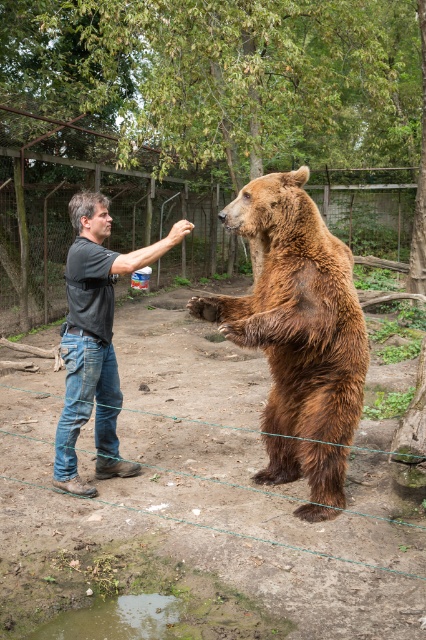
Is metal wire fence at center further to camera compared to jeans at center?

That is True.

Is metal wire fence at center to the right of jeans at center from the viewer's perspective?

Yes, metal wire fence at center is to the right of jeans at center.

The image size is (426, 640). I want to click on metal wire fence at center, so click(368, 220).

Who is lower down, brown furry bear at center or jeans at center?

jeans at center is lower down.

Image resolution: width=426 pixels, height=640 pixels. In order to click on brown furry bear at center in this screenshot , I will do `click(296, 310)`.

This screenshot has height=640, width=426. In order to click on brown furry bear at center in this screenshot , I will do `click(296, 310)`.

Which is more to the left, brown furry bear at center or metal wire fence at center?

From the viewer's perspective, metal wire fence at center appears more on the left side.

What do you see at coordinates (296, 310) in the screenshot? I see `brown furry bear at center` at bounding box center [296, 310].

The image size is (426, 640). In order to click on brown furry bear at center in this screenshot , I will do `click(296, 310)`.